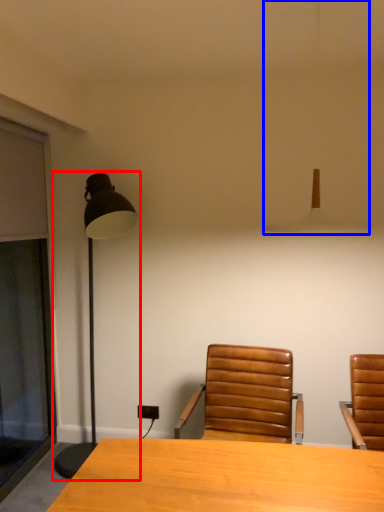
Question: Which object is closer to the camera taking this photo, lamp (highlighted by a red box) or lamp (highlighted by a blue box)?

Choices:
 (A) lamp
 (B) lamp

Answer: (B)